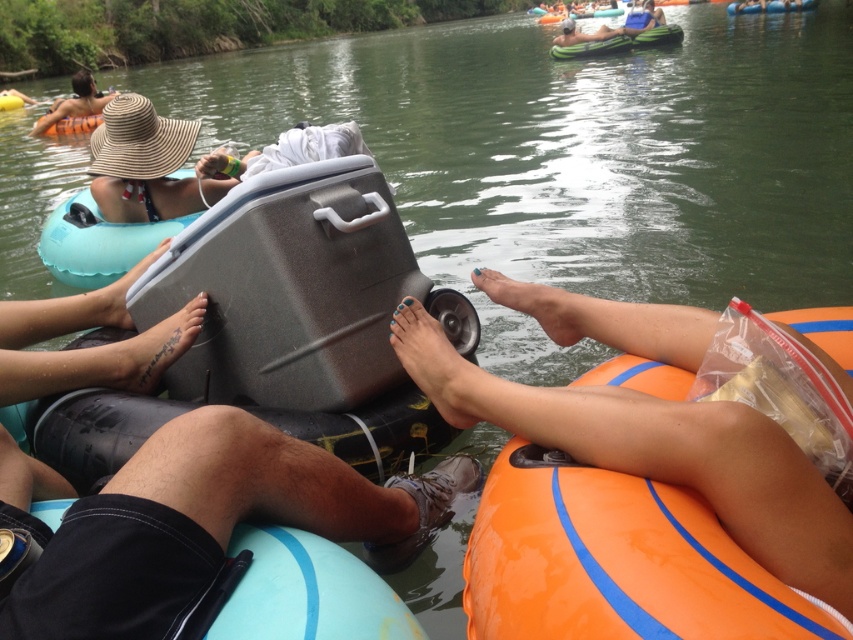
Who is positioned more to the right, smooth orange tube at lower right or straw hat at upper left?

From the viewer's perspective, smooth orange tube at lower right appears more on the right side.

Can you confirm if smooth orange tube at lower right is positioned above straw hat at upper left?

No, smooth orange tube at lower right is not above straw hat at upper left.

The image size is (853, 640). What do you see at coordinates (659, 452) in the screenshot?
I see `smooth orange tube at lower right` at bounding box center [659, 452].

Image resolution: width=853 pixels, height=640 pixels. I want to click on smooth orange tube at lower right, so click(x=659, y=452).

Is point (457, 374) behind point (635, 33)?

That is False.

Which is below, matte black foot at center or green rubber raft at upper center?

matte black foot at center is below.

Between point (402, 352) and point (592, 42), which one is positioned in front?

Positioned in front is point (402, 352).

Image resolution: width=853 pixels, height=640 pixels. Identify the location of matte black foot at center. (428, 355).

Does smooth orange tube at lower right appear on the right side of matte black foot at center?

Indeed, smooth orange tube at lower right is positioned on the right side of matte black foot at center.

Is smooth orange tube at lower right positioned in front of matte black foot at center?

Yes, it is.

Who is more distant from viewer, (827, 560) or (431, 384)?

The point (431, 384) is more distant.

You are a GUI agent. You are given a task and a screenshot of the screen. Output one action in this format:
    pyautogui.click(x=<x>, y=<y>)
    Task: Click on the smooth orange tube at lower right
    
    Given the screenshot: What is the action you would take?
    click(x=659, y=452)